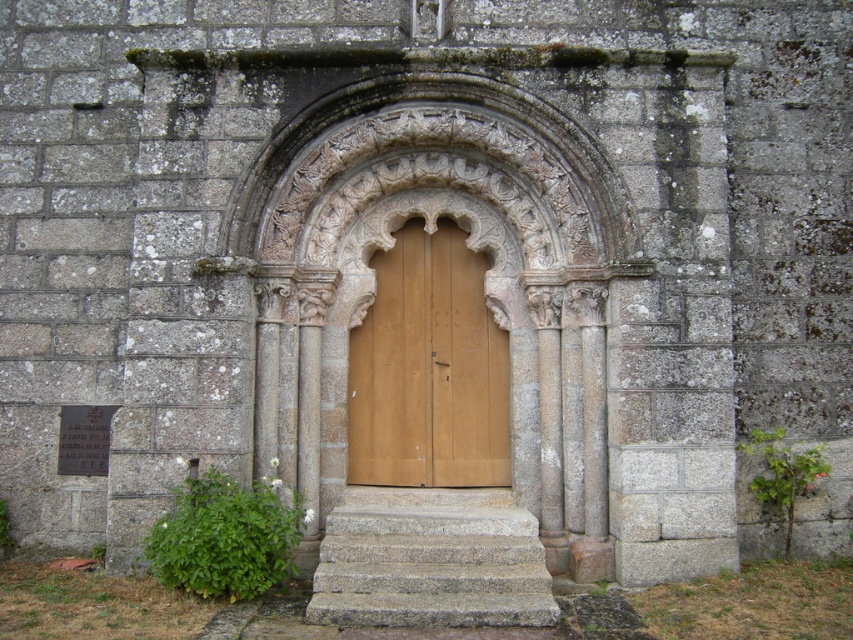
Is wooden door at center positioned in front of gray stone stairs at center?

No, wooden door at center is further to the viewer.

Consider the image. Who is positioned more to the right, wooden door at center or gray stone stairs at center?

From the viewer's perspective, gray stone stairs at center appears more on the right side.

Between point (477, 419) and point (407, 556), which one is positioned behind?

Point (477, 419)

Locate an element on the screen. This screenshot has height=640, width=853. wooden door at center is located at coordinates (428, 369).